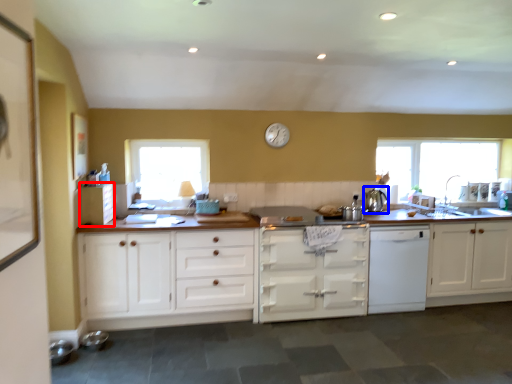
Question: Which object appears closest to the camera in this image, cabinetry (highlighted by a red box) or tea pot (highlighted by a blue box)?

Choices:
 (A) cabinetry
 (B) tea pot

Answer: (A)